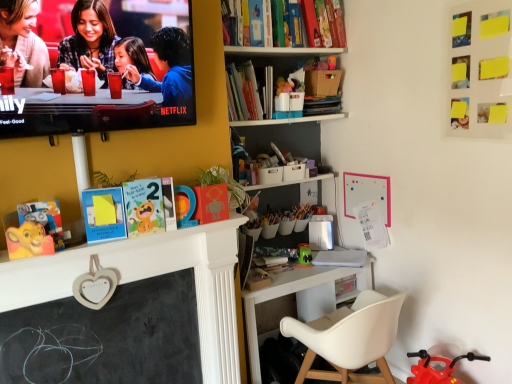
Question: Is matte black laptop at upper left behind white paper at desk center, the 3th book from the top?

Choices:
 (A) no
 (B) yes

Answer: (A)

Question: From the image's perspective, is matte black laptop at upper left above white paper at desk center, the 3th book from the top?

Choices:
 (A) no
 (B) yes

Answer: (B)

Question: Is matte black laptop at upper left taller than white paper at desk center, the 1th book when ordered from bottom to top?

Choices:
 (A) yes
 (B) no

Answer: (A)

Question: From a real-world perspective, is matte black laptop at upper left beneath white paper at desk center, the 1th book when ordered from bottom to top?

Choices:
 (A) no
 (B) yes

Answer: (A)

Question: Is matte black laptop at upper left oriented towards white paper at desk center, the 1th book when ordered from bottom to top?

Choices:
 (A) yes
 (B) no

Answer: (B)

Question: In the image, is white plastic chair at lower right positioned in front of or behind green matte toy at center?

Choices:
 (A) behind
 (B) front

Answer: (B)

Question: From a real-world perspective, relative to green matte toy at center, is white plastic chair at lower right vertically above or below?

Choices:
 (A) below
 (B) above

Answer: (A)

Question: In terms of width, does white plastic chair at lower right look wider or thinner when compared to green matte toy at center?

Choices:
 (A) wide
 (B) thin

Answer: (A)

Question: Is white plastic chair at lower right taller or shorter than green matte toy at center?

Choices:
 (A) tall
 (B) short

Answer: (A)

Question: In terms of size, does green matte toy at center appear bigger or smaller than white plastic chair at lower right?

Choices:
 (A) big
 (B) small

Answer: (B)

Question: In the image, is green matte toy at center on the left side or the right side of white plastic chair at lower right?

Choices:
 (A) left
 (B) right

Answer: (A)

Question: Considering the positions of green matte toy at center and white plastic chair at lower right in the image, is green matte toy at center taller or shorter than white plastic chair at lower right?

Choices:
 (A) tall
 (B) short

Answer: (B)

Question: From the image's perspective, relative to white plastic chair at lower right, is green matte toy at center above or below?

Choices:
 (A) above
 (B) below

Answer: (A)

Question: Looking at their shapes, would you say black chalkboard at center-left is wider or thinner than matte black laptop at upper left?

Choices:
 (A) thin
 (B) wide

Answer: (A)

Question: Looking at the image, does black chalkboard at center-left seem bigger or smaller compared to matte black laptop at upper left?

Choices:
 (A) small
 (B) big

Answer: (A)